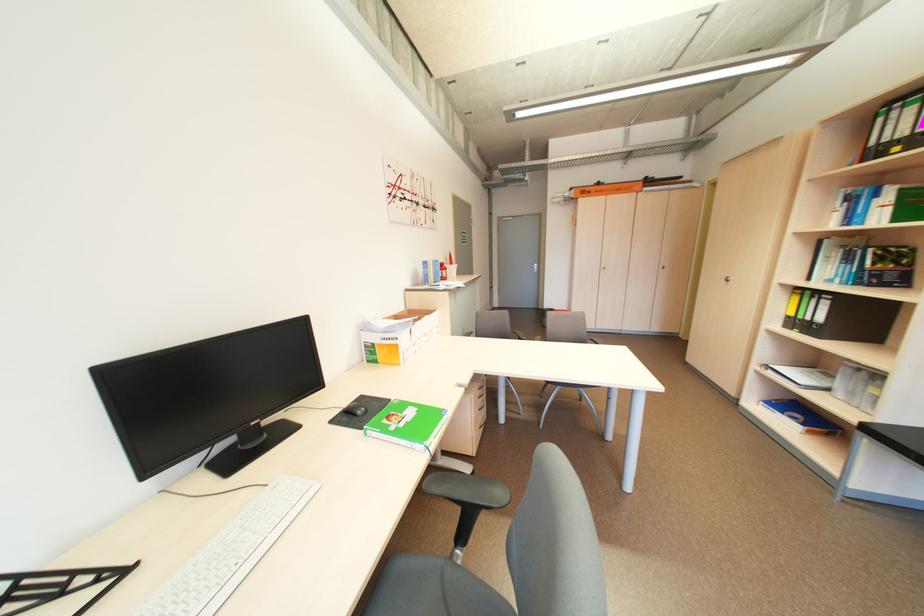
What do you see at coordinates (432, 590) in the screenshot? I see `the grey chair sitting surface` at bounding box center [432, 590].